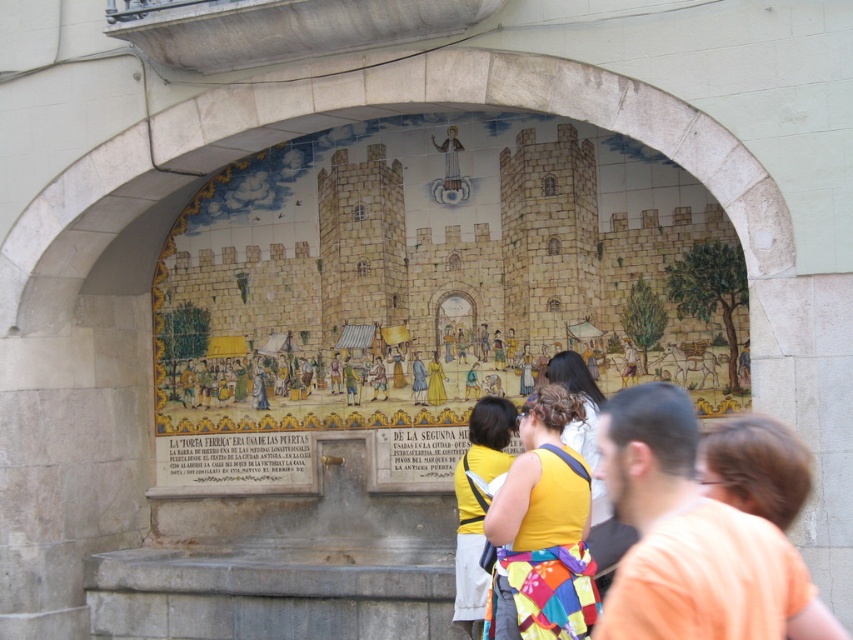
Does orange cotton shirt at lower right have a greater width compared to yellow fabric backpack at center?

Indeed, orange cotton shirt at lower right has a greater width compared to yellow fabric backpack at center.

Between point (688, 612) and point (525, 429), which one is positioned in front?

Point (688, 612)

This screenshot has width=853, height=640. Find the location of `orange cotton shirt at lower right`. orange cotton shirt at lower right is located at coordinates (691, 540).

Does orange cotton shirt at lower right have a lesser width compared to yellow fabric at center?

No.

Which is in front, point (782, 544) or point (595, 410)?

Point (782, 544)

At what (x,y) coordinates should I click in order to perform the action: click on orange cotton shirt at lower right. Please return your answer as a coordinate pair (x, y). Looking at the image, I should click on (691, 540).

Is yellow fabric backpack at center bigger than blonde hair at center?

Yes.

What do you see at coordinates (543, 529) in the screenshot? I see `yellow fabric backpack at center` at bounding box center [543, 529].

The height and width of the screenshot is (640, 853). Identify the location of yellow fabric backpack at center. (543, 529).